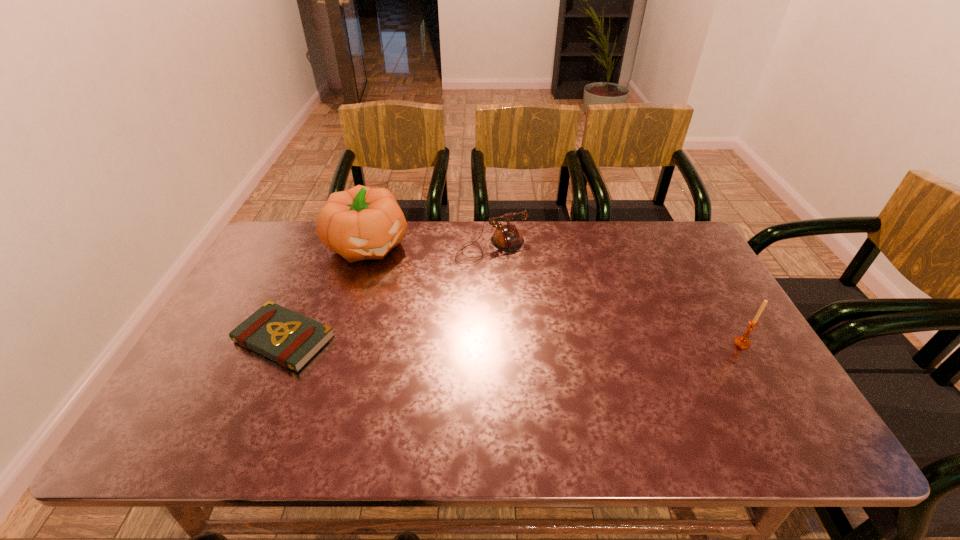
You are a GUI agent. You are given a task and a screenshot of the screen. Output one action in this format:
    pyautogui.click(x=<x>, y=<y>)
    Task: Click on the free spot at the left edge of the desktop
    The width and height of the screenshot is (960, 540).
    Given the screenshot: What is the action you would take?
    pyautogui.click(x=283, y=271)

In the image, there is a desktop. In order to click on vacant space at the right edge in this screenshot , I will do `click(713, 284)`.

In the image, there is a desktop. At what (x,y) coordinates should I click in order to perform the action: click on free space at the far left corner. Please return your answer as a coordinate pair (x, y). The image size is (960, 540). Looking at the image, I should click on (275, 230).

Where is `vacant space at the far right corner`? This screenshot has height=540, width=960. vacant space at the far right corner is located at coordinates (660, 245).

The width and height of the screenshot is (960, 540). In the image, there is a desktop. Find the location of `vacant space at the near right corner`. vacant space at the near right corner is located at coordinates (743, 409).

This screenshot has width=960, height=540. I want to click on vacant area that lies between the telephone and the rightmost object, so click(617, 295).

This screenshot has width=960, height=540. What are the coordinates of `free space between the book and the second object from right to left` in the screenshot? It's located at (388, 293).

Where is `free point between the candle_holder and the tallest object`? The width and height of the screenshot is (960, 540). free point between the candle_holder and the tallest object is located at coordinates (556, 294).

Identify the location of vacant space that is in between the candle_holder and the shortest object. This screenshot has height=540, width=960. (514, 341).

You are a GUI agent. You are given a task and a screenshot of the screen. Output one action in this format:
    pyautogui.click(x=<x>, y=<y>)
    Task: Click on the free space between the third tallest object and the book
    This screenshot has height=540, width=960.
    Given the screenshot: What is the action you would take?
    coord(388,293)